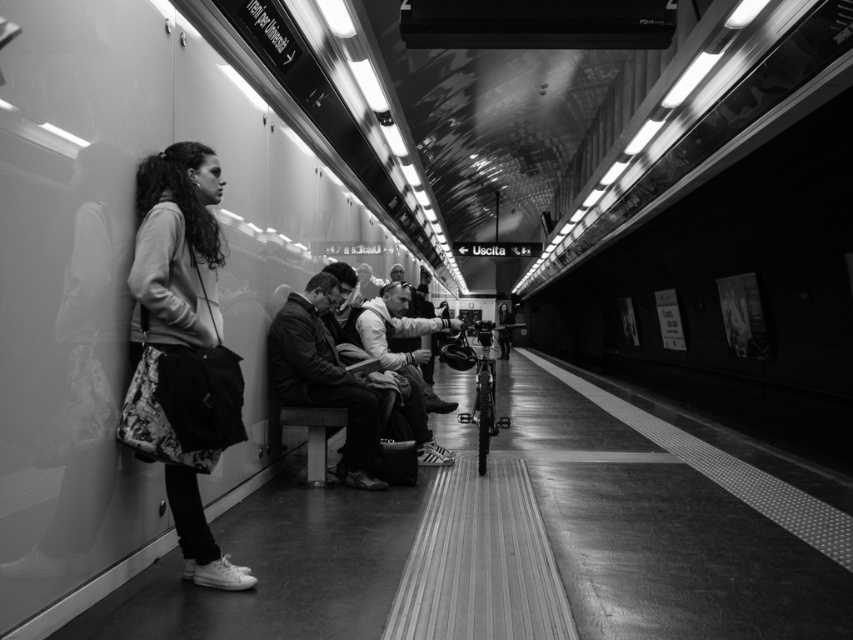
Question: Which of the following is the closest to the observer?

Choices:
 (A) leather jacket at center
 (B) floral skirt at left
 (C) white cotton shirt at center

Answer: (B)

Question: Which point is farther to the camera?

Choices:
 (A) white cotton shirt at center
 (B) leather jacket at center

Answer: (A)

Question: Is floral skirt at left further to camera compared to white cotton shirt at center?

Choices:
 (A) no
 (B) yes

Answer: (A)

Question: In this image, where is floral skirt at left located relative to leather jacket at center?

Choices:
 (A) below
 (B) above

Answer: (B)

Question: Can you confirm if floral skirt at left is positioned to the right of white cotton shirt at center?

Choices:
 (A) no
 (B) yes

Answer: (A)

Question: Which point appears farthest from the camera in this image?

Choices:
 (A) (180, 250)
 (B) (322, 291)

Answer: (B)